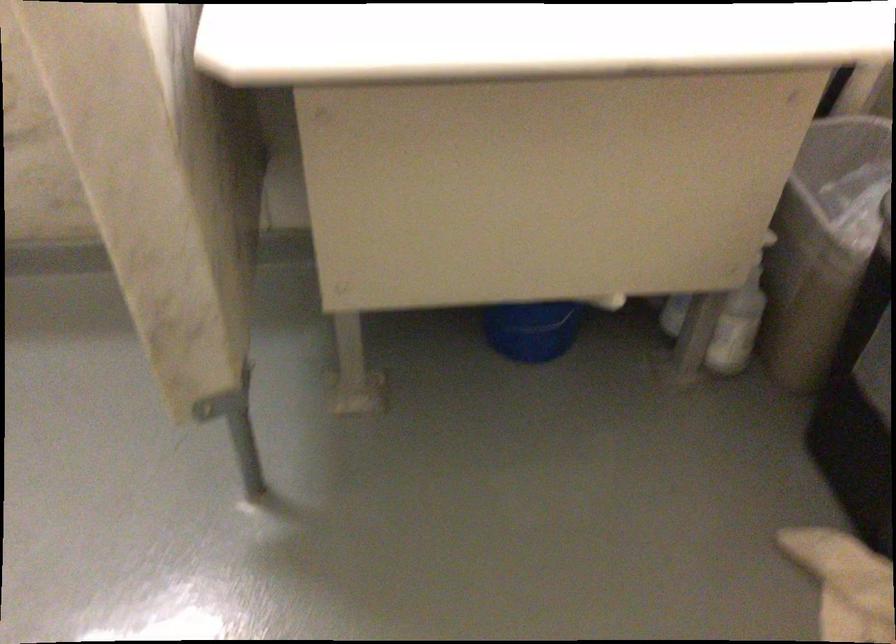
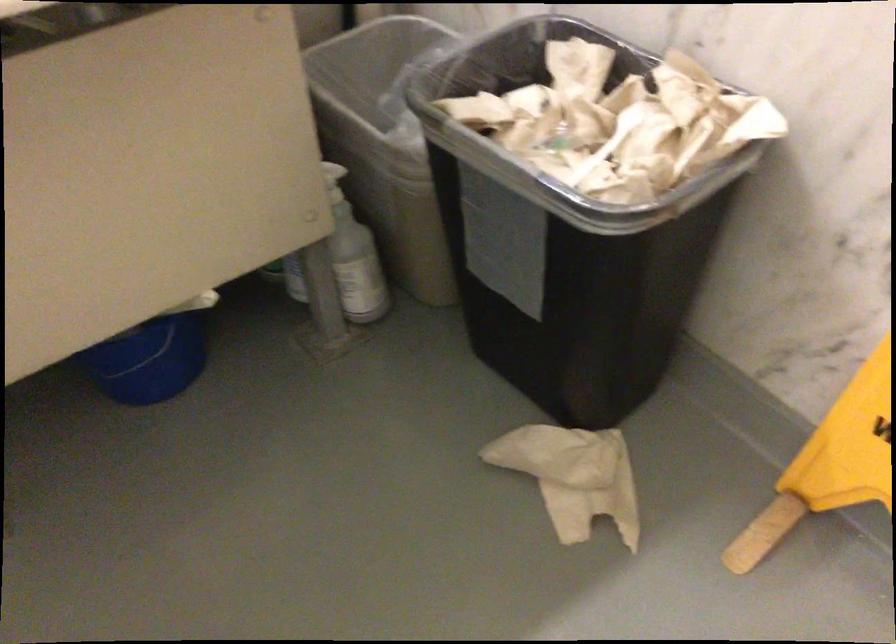
The point at (752,237) is marked in the first image. Where is the corresponding point in the second image?

(333, 182)